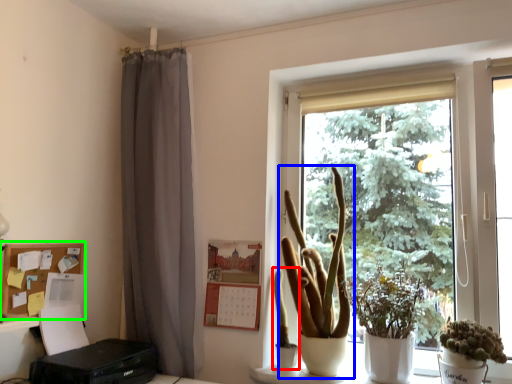
Question: Which object is the closest to the plant (highlighted by a red box)? Choose among these: houseplant (highlighted by a blue box) or shelf (highlighted by a green box).

Choices:
 (A) houseplant
 (B) shelf

Answer: (A)